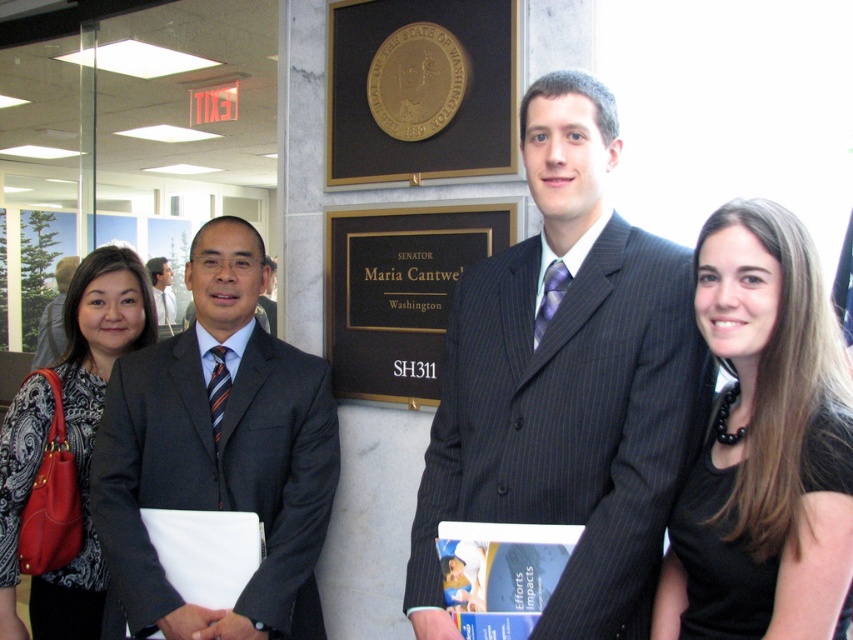
Which is more to the right, black matte shirt at center or dark gray suit at center?

From the viewer's perspective, black matte shirt at center appears more on the right side.

Find the location of a particular element. Image resolution: width=853 pixels, height=640 pixels. black matte shirt at center is located at coordinates (764, 444).

Locate an element on the screen. black matte shirt at center is located at coordinates click(764, 444).

Is gold/black plaque at center taller than dark gray suit at center?

Incorrect, gold/black plaque at center's height is not larger of dark gray suit at center's.

Is point (402, 273) farther from camera compared to point (155, 305)?

That is False.

Who is more forward, (x=444, y=259) or (x=152, y=280)?

Positioned in front is point (x=444, y=259).

The width and height of the screenshot is (853, 640). In order to click on gold/black plaque at center in this screenshot , I will do `click(399, 292)`.

Who is more distant from viewer, (610, 554) or (849, 419)?

Point (610, 554)

Does pinstriped suit at center appear under black matte shirt at center?

No, pinstriped suit at center is not below black matte shirt at center.

Does point (621, 220) come in front of point (746, 374)?

No, it is not.

You are a GUI agent. You are given a task and a screenshot of the screen. Output one action in this format:
    pyautogui.click(x=<x>, y=<y>)
    Task: Click on the pinstriped suit at center
    This screenshot has height=640, width=853.
    Given the screenshot: What is the action you would take?
    pyautogui.click(x=567, y=384)